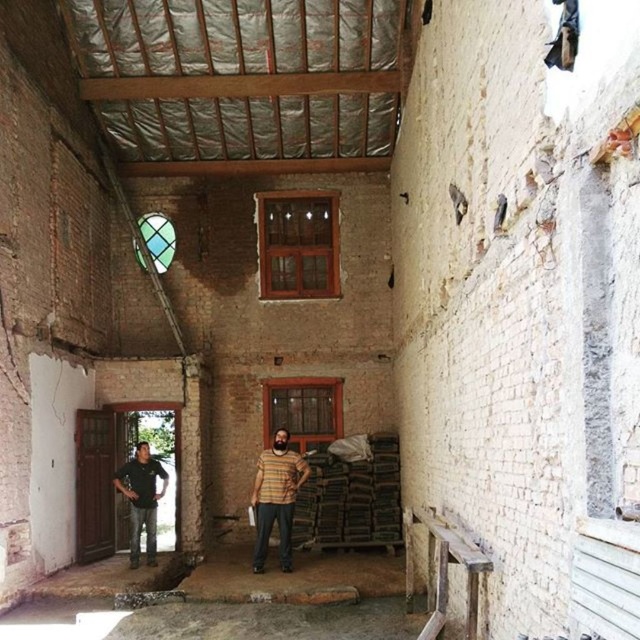
Question: Among these points, which one is farthest from the camera?

Choices:
 (A) (134, 456)
 (B) (285, 516)

Answer: (A)

Question: Is striped fabric shirt at center bigger than black cotton shirt at left?

Choices:
 (A) no
 (B) yes

Answer: (A)

Question: Does striped fabric shirt at center have a greater width compared to black cotton shirt at left?

Choices:
 (A) yes
 (B) no

Answer: (B)

Question: Does striped fabric shirt at center come behind black cotton shirt at left?

Choices:
 (A) no
 (B) yes

Answer: (A)